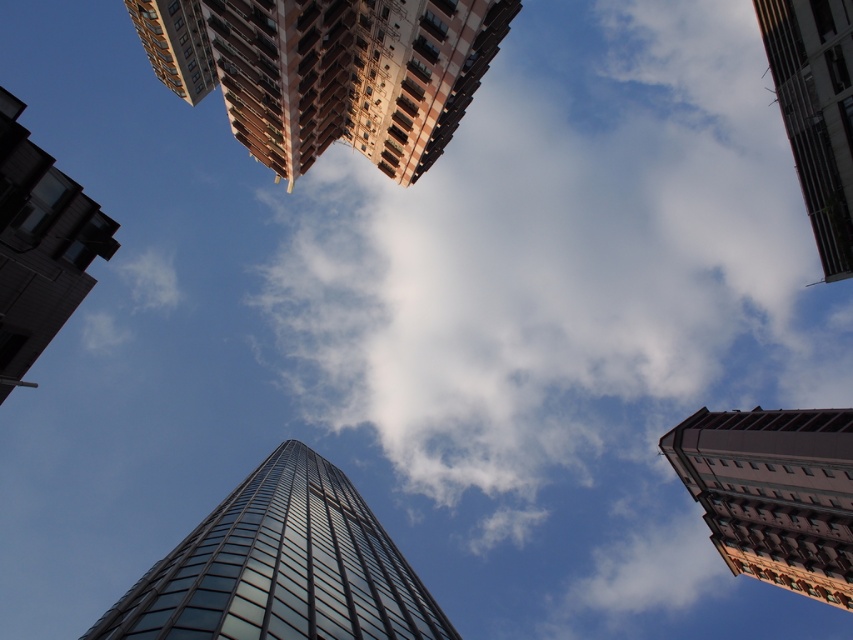
You are an architect analyzing the urban skyline. You notice two brown textured buildings in the scene. Which one has a larger footprint? The options are the brown textured building at upper center and the brown textured building at right.

The brown textured building at upper center has a larger footprint than the brown textured building at right.

You are a city planner analyzing the skyline. You observe the brown textured building at upper center and the brown textured building at right. Which one appears wider from your vantage point?

The brown textured building at upper center appears wider than the brown textured building at right because its width surpasses the latter.